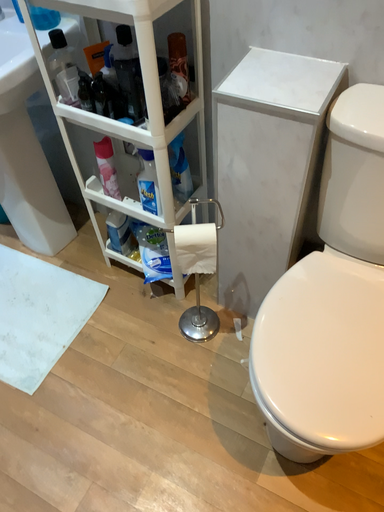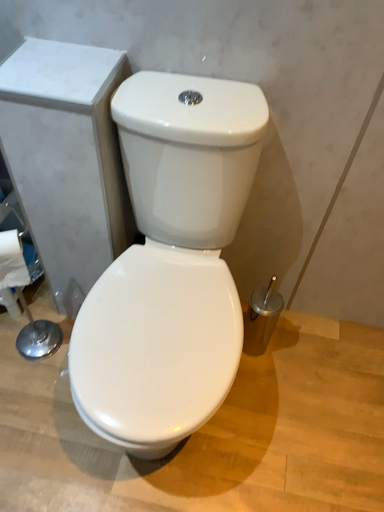
Question: Which way did the camera rotate in the video?

Choices:
 (A) rotated right
 (B) rotated left

Answer: (A)